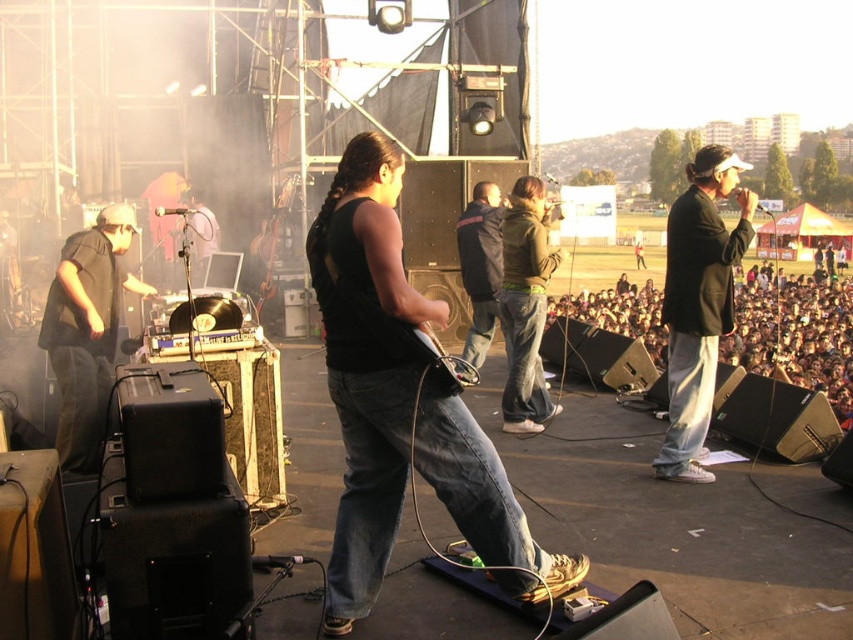
Question: Which object is farther from the camera taking this photo?

Choices:
 (A) black matte clothing at left
 (B) black matte jacket at center

Answer: (B)

Question: Among these points, which one is farthest from the camera?

Choices:
 (A) (260, 305)
 (B) (705, 164)

Answer: (A)

Question: Can you confirm if dark blue jeans at center is wider than wooden acoustic guitar at center?

Choices:
 (A) no
 (B) yes

Answer: (A)

Question: Which point is farther to the camera?

Choices:
 (A) (44, 339)
 (B) (833, 403)
 (C) (379, 212)
 (D) (254, 305)

Answer: (B)

Question: Is black matte jacket at center wider than green fleece jacket at center?

Choices:
 (A) yes
 (B) no

Answer: (A)

Question: Observing the image, what is the correct spatial positioning of black matte tank top at center in reference to wooden acoustic guitar at center?

Choices:
 (A) above
 (B) below

Answer: (B)